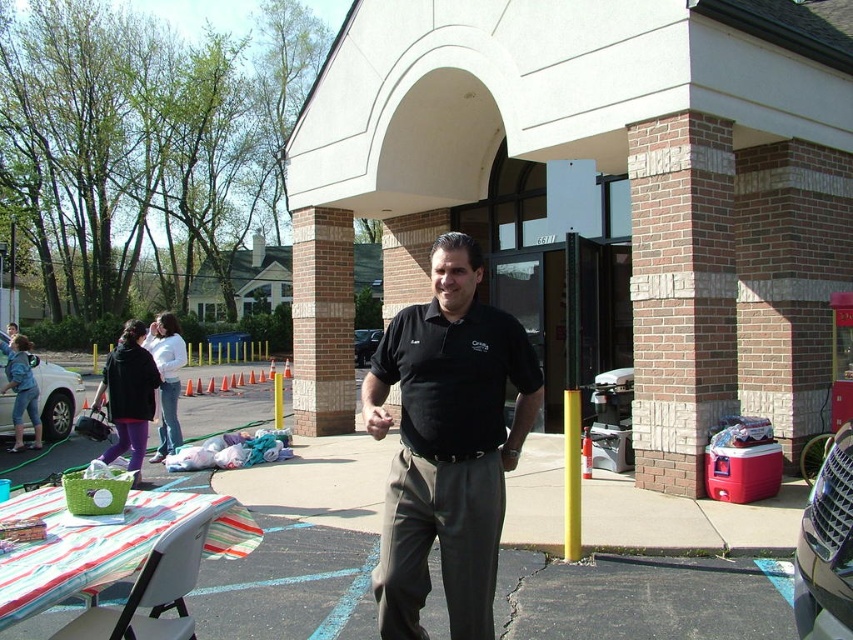
Question: Where is black smooth shirt at center located in relation to striped fabric picnic table at lower left in the image?

Choices:
 (A) right
 (B) left

Answer: (A)

Question: Does black matte car at center have a larger size compared to yellow plastic pole at center?

Choices:
 (A) yes
 (B) no

Answer: (A)

Question: Which object appears closest to the camera in this image?

Choices:
 (A) black smooth shirt at center
 (B) yellow plastic pole at center
 (C) black matte car at center
 (D) yellow matte pole at center

Answer: (A)

Question: Among these objects, which one is nearest to the camera?

Choices:
 (A) yellow matte pole at center
 (B) smooth asphalt pavement at center
 (C) black matte car at center

Answer: (B)

Question: Which point is closer to the camera?

Choices:
 (A) (566, 301)
 (B) (368, 346)

Answer: (A)

Question: Is black matte car at center thinner than yellow plastic pole at center?

Choices:
 (A) no
 (B) yes

Answer: (B)